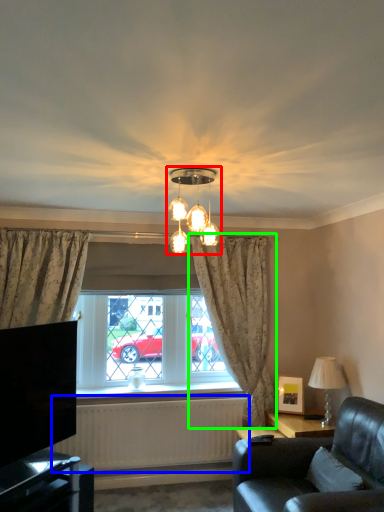
Question: Estimate the real-world distances between objects in this image. Which object is closer to lamp (highlighted by a red box), radiator (highlighted by a blue box) or curtain (highlighted by a green box)?

Choices:
 (A) radiator
 (B) curtain

Answer: (B)